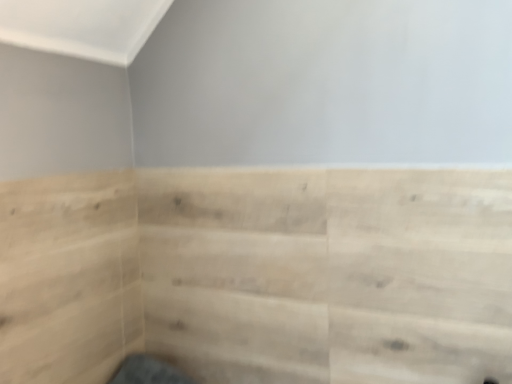
This screenshot has width=512, height=384. I want to click on light wood paneling at center, so click(x=260, y=274).

Describe the element at coordinates (260, 274) in the screenshot. I see `light wood paneling at center` at that location.

What is the approximate width of light wood paneling at center?

1.23 inches.

Where is `light wood paneling at center`? light wood paneling at center is located at coordinates (260, 274).